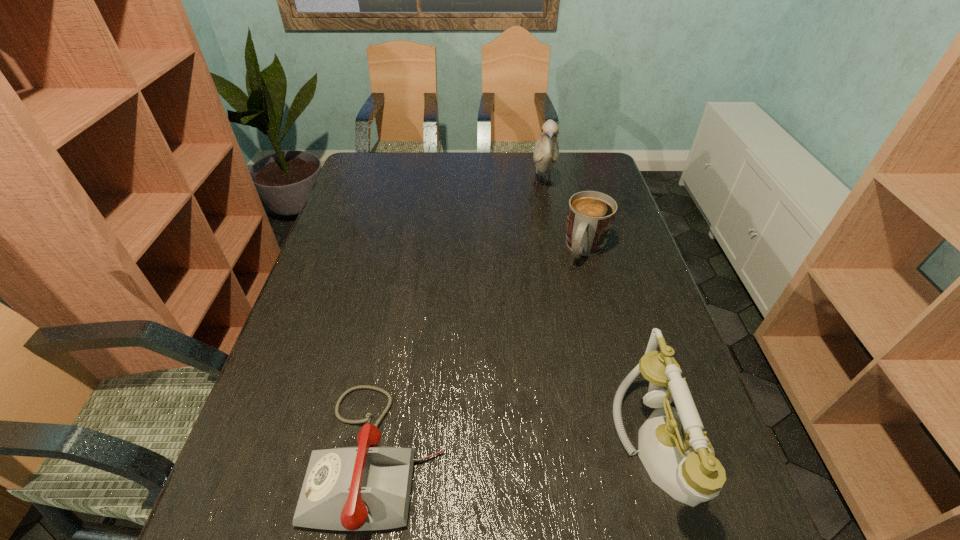
Where is `the second tallest object`? This screenshot has width=960, height=540. the second tallest object is located at coordinates (678, 456).

The image size is (960, 540). In order to click on the right telephone in this screenshot , I will do `click(678, 456)`.

You are a GUI agent. You are given a task and a screenshot of the screen. Output one action in this format:
    pyautogui.click(x=<x>, y=<y>)
    Task: Click on the third nearest object
    This screenshot has height=540, width=960.
    Given the screenshot: What is the action you would take?
    pyautogui.click(x=590, y=216)

This screenshot has height=540, width=960. Identify the location of the third tallest object. (590, 216).

Where is `the farthest object`? the farthest object is located at coordinates (546, 153).

Identify the location of the tallest object. The image size is (960, 540). (546, 153).

Where is `vacant space located 0.160m on the side of the mug with the handle`? Image resolution: width=960 pixels, height=540 pixels. vacant space located 0.160m on the side of the mug with the handle is located at coordinates (563, 306).

I want to click on vacant area located 0.290m on the side of the mug with the handle, so click(544, 342).

Where is `vacant region located 0.100m on the side of the mug with the handle`? Image resolution: width=960 pixels, height=540 pixels. vacant region located 0.100m on the side of the mug with the handle is located at coordinates (569, 291).

This screenshot has height=540, width=960. I want to click on free location located 0.130m at the beak of the bird, so click(x=546, y=226).